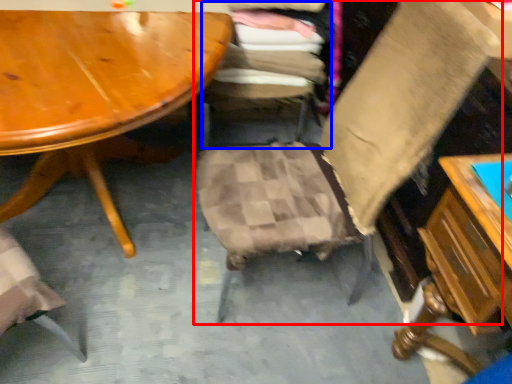
Question: Which point is closer to the camera, chair (highlighted by a red box) or chair (highlighted by a blue box)?

Choices:
 (A) chair
 (B) chair

Answer: (A)